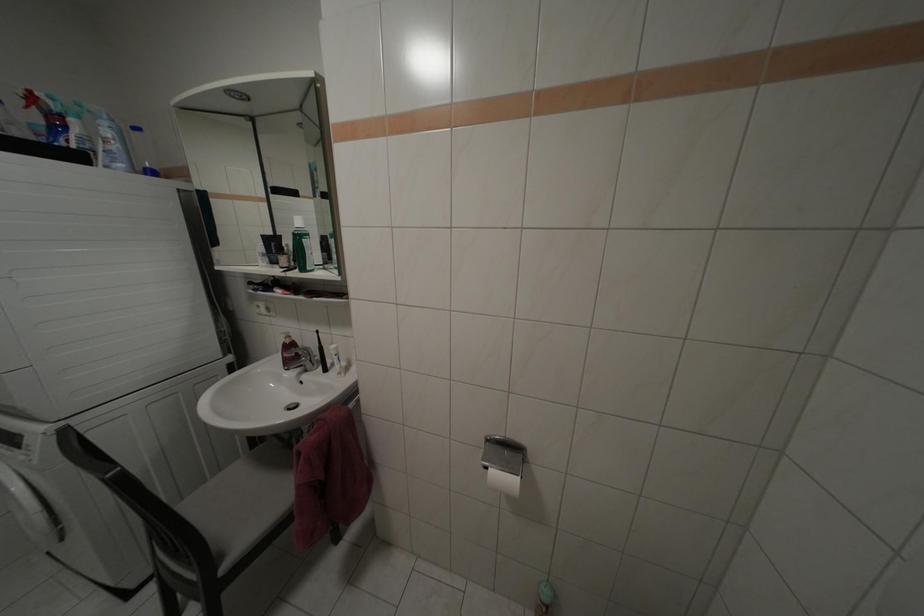
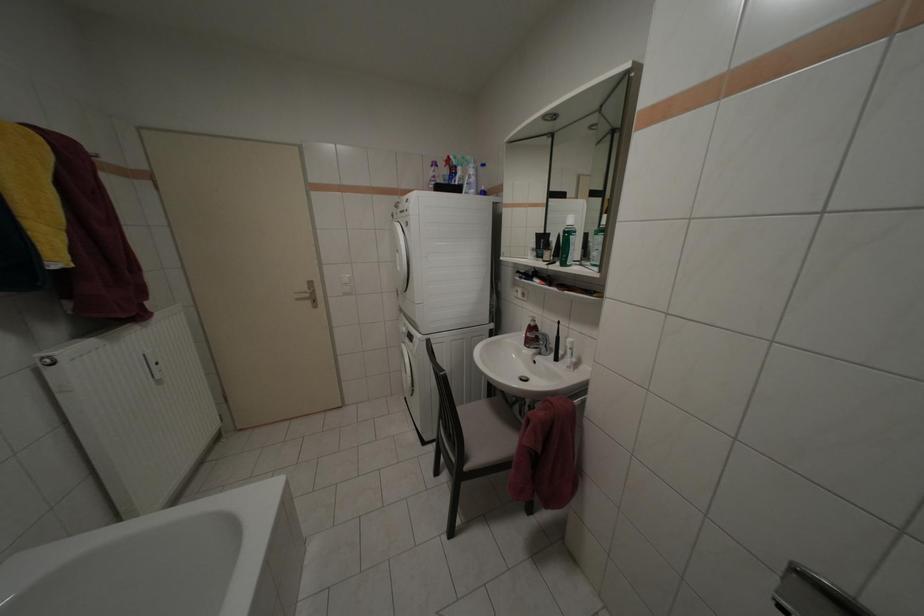
Question: The camera is either moving clockwise (left) or counter-clockwise (right) around the object. The first image is from the beginning of the video and the second image is from the end. Is the camera moving left or right when shooting the video?

Choices:
 (A) Left
 (B) Right

Answer: (B)